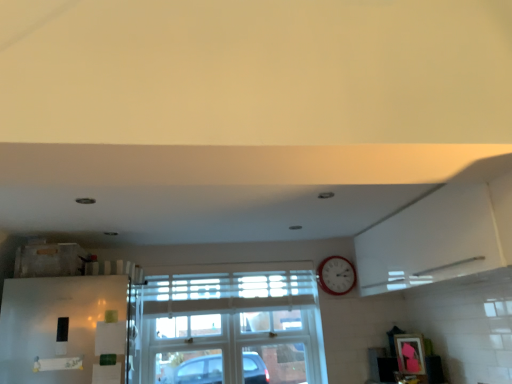
Question: Visually, is metallic red clock at upper right positioned to the left or to the right of clear glass window at center?

Choices:
 (A) right
 (B) left

Answer: (A)

Question: Considering the positions of metallic red clock at upper right and clear glass window at center in the image, is metallic red clock at upper right taller or shorter than clear glass window at center?

Choices:
 (A) short
 (B) tall

Answer: (A)

Question: From a real-world perspective, is metallic red clock at upper right positioned above or below clear glass window at center?

Choices:
 (A) below
 (B) above

Answer: (B)

Question: Looking at their shapes, would you say clear glass window at center is wider or thinner than metallic red clock at upper right?

Choices:
 (A) thin
 (B) wide

Answer: (B)

Question: Is clear glass window at center situated inside metallic red clock at upper right or outside?

Choices:
 (A) inside
 (B) outside

Answer: (B)

Question: In terms of height, does clear glass window at center look taller or shorter compared to metallic red clock at upper right?

Choices:
 (A) tall
 (B) short

Answer: (A)

Question: Is point (144, 342) closer or farther from the camera than point (335, 291)?

Choices:
 (A) closer
 (B) farther

Answer: (A)